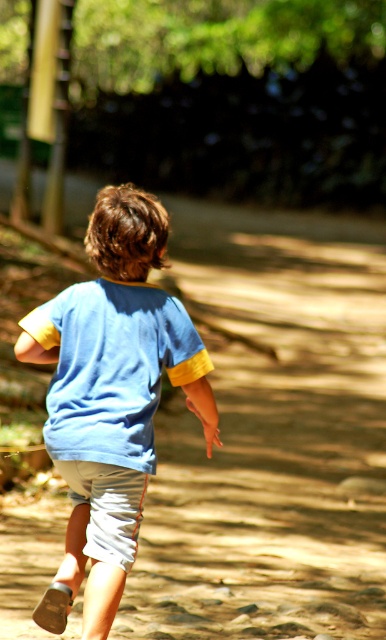
Is point (145, 316) behind point (93, 496)?

Yes, point (145, 316) is behind point (93, 496).

Is the position of blue cotton shirt at center more distant than that of white cotton shorts at lower center?

No, it is not.

Between point (116, 481) and point (108, 476), which one is positioned in front?

Positioned in front is point (108, 476).

Locate an element on the screen. The height and width of the screenshot is (640, 386). blue cotton shirt at center is located at coordinates (111, 396).